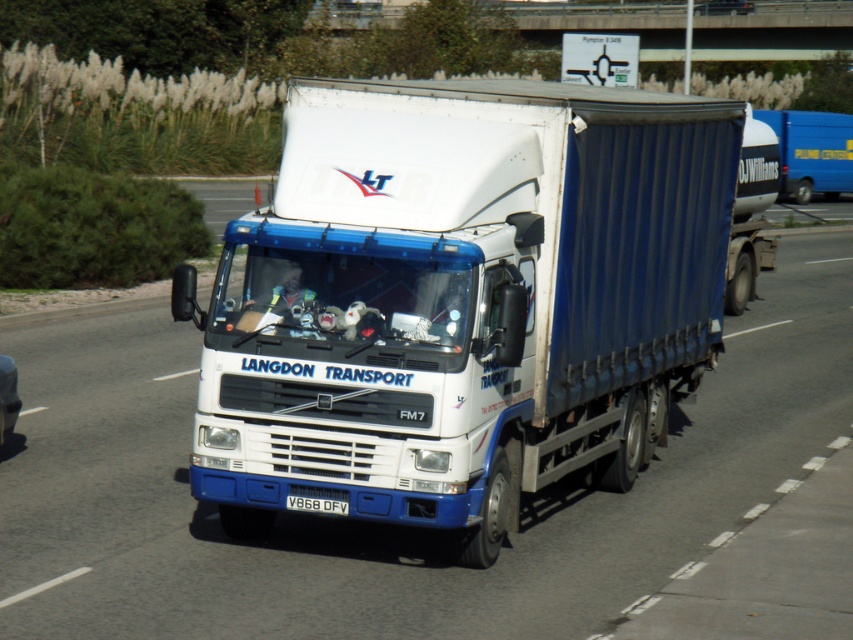
You are standing at the point marked by point (x=10, y=397) and want to take a photo of the Volvo FM7 truck. However, there is an obstacle blocking your view. You decide to move to point (x=503, y=616). Will moving to this new position allow you to see the truck better?

Moving to point (x=503, y=616) will allow you to see the truck better because it is closer to the camera than point (x=10, y=397), providing a clearer view.

Consider the image. You are a photographer trying to capture the white matte truck at center and the white plastic license plate at center in a single shot. Since both are white, will the license plate at center be visible against the truck?

The white matte truck at center is in front of the white plastic license plate at center, so the truck will block the license plate from view, making it invisible in the photo.